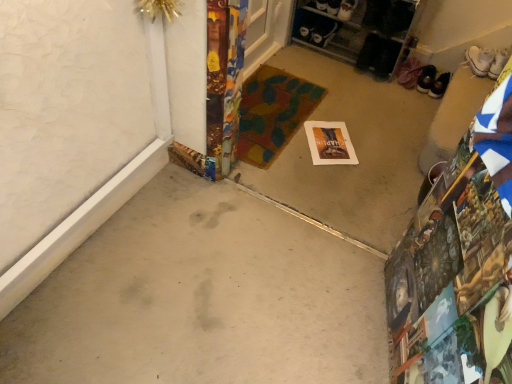
Question: Based on their sizes in the image, would you say black leather shoes at upper right, which ranks as the 2th footwear in right-to-left order, is bigger or smaller than matte paper postcard at center?

Choices:
 (A) big
 (B) small

Answer: (B)

Question: Relative to matte paper postcard at center, is black leather shoes at upper right, which ranks as the 2th footwear in right-to-left order, in front or behind?

Choices:
 (A) behind
 (B) front

Answer: (A)

Question: Considering the real-world distances, which object is farthest from the black leather shoes at upper right, positioned as the second footwear in left-to-right order?

Choices:
 (A) black leather shoes at upper right, which is the third footwear in right-to-left order
 (B) gray concrete at center, marked as the 1th concrete in a front-to-back arrangement
 (C) matte paper postcard at center
 (D) smooth concrete floor at center, which is the 1th concrete in back-to-front order
 (E) multicolored fabric doormat at center

Answer: (B)

Question: Estimate the real-world distances between objects in this image. Which object is farther from the black leather shoes at upper right, which is the 1th footwear from left to right?

Choices:
 (A) matte paper postcard at center
 (B) white canvas sneakers at upper right, arranged as the 3th footwear when viewed from the left
 (C) gray concrete at center, marked as the 1th concrete in a front-to-back arrangement
 (D) smooth concrete floor at center, which is the 1th concrete in back-to-front order
 (E) multicolored fabric doormat at center

Answer: (C)